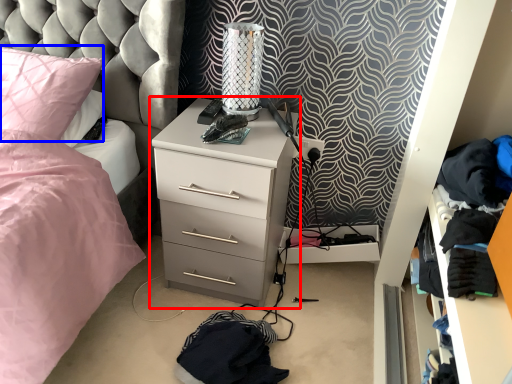
Question: Which object is closer to the camera taking this photo, chest of drawers (highlighted by a red box) or pillow (highlighted by a blue box)?

Choices:
 (A) chest of drawers
 (B) pillow

Answer: (A)